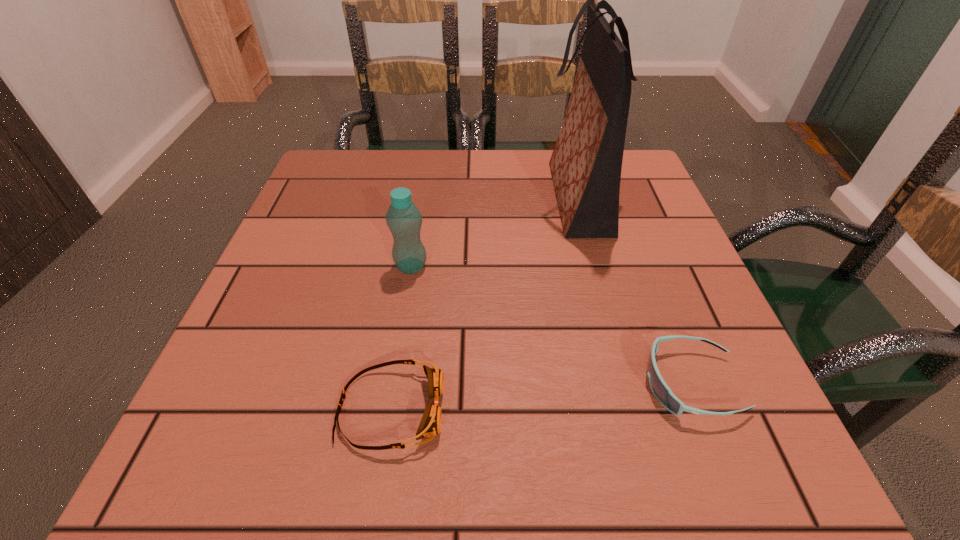
In order to click on blank region between the shopping bag and the second tallest object in this screenshot , I will do `click(494, 232)`.

Image resolution: width=960 pixels, height=540 pixels. Find the location of `vacant space that is in between the left goggles and the shopping bag`. vacant space that is in between the left goggles and the shopping bag is located at coordinates (484, 303).

This screenshot has height=540, width=960. Find the location of `vacant point located between the shopping bag and the right goggles`. vacant point located between the shopping bag and the right goggles is located at coordinates (634, 291).

Image resolution: width=960 pixels, height=540 pixels. Find the location of `vacant area that lies between the farthest object and the left goggles`. vacant area that lies between the farthest object and the left goggles is located at coordinates (484, 303).

The height and width of the screenshot is (540, 960). In order to click on empty space between the tallest object and the right goggles in this screenshot , I will do `click(634, 291)`.

The width and height of the screenshot is (960, 540). What are the coordinates of `unoccupied position between the right goggles and the tallest object` in the screenshot? It's located at (634, 291).

Image resolution: width=960 pixels, height=540 pixels. In order to click on the second closest object to the shopping bag in this screenshot , I will do `click(660, 389)`.

Where is `object that is the closest to the third nearest object`? object that is the closest to the third nearest object is located at coordinates (430, 425).